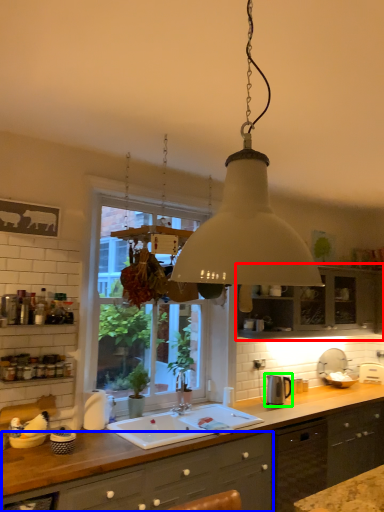
Question: Which is farther away from cabinetry (highlighted by a red box)? cabinetry (highlighted by a blue box) or appliance (highlighted by a green box)?

Choices:
 (A) cabinetry
 (B) appliance

Answer: (A)